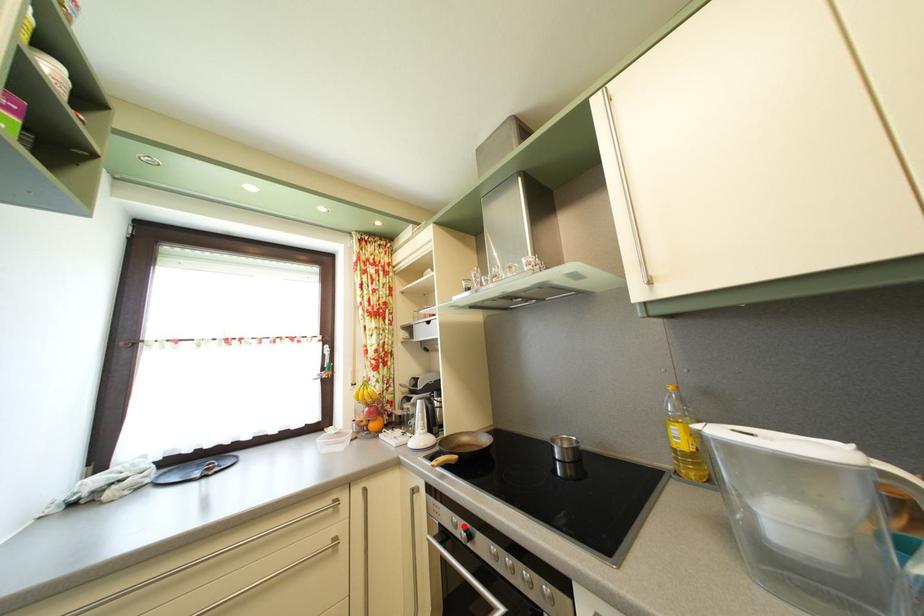
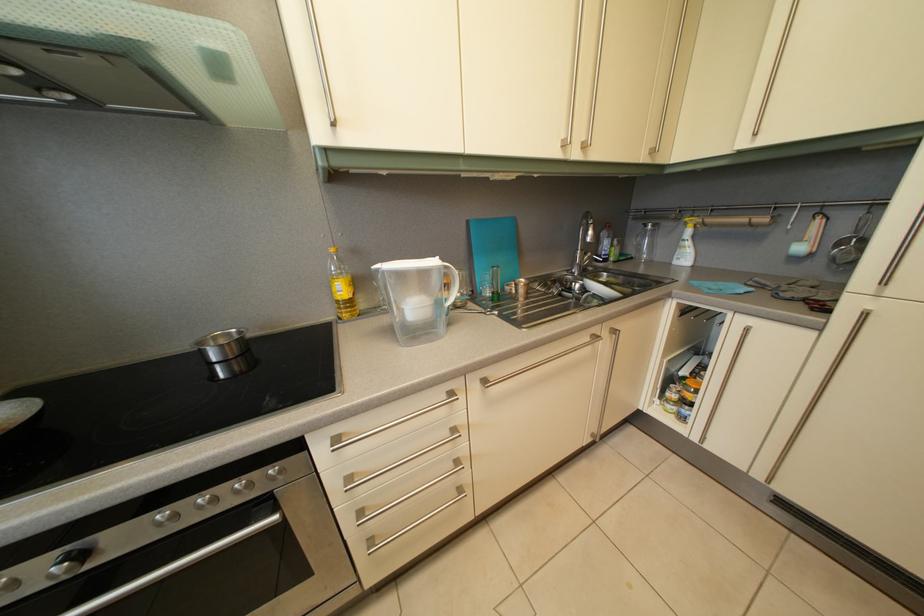
Locate, in the second image, the point that corresponds to the highlighted location in the first image.

(8, 586)